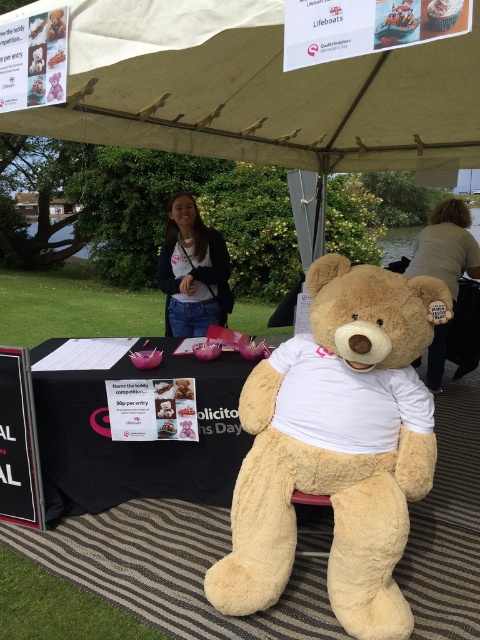
In the scene shown: Between fluffy beige teddy bear at center and matte white shirt at center, which one has more height?

fluffy beige teddy bear at center

Measure the distance between fluffy beige teddy bear at center and camera.

fluffy beige teddy bear at center and camera are 1.96 meters apart from each other.

I want to click on fluffy beige teddy bear at center, so click(x=336, y=449).

Does black fabric table at center lie in front of matte white shirt at center?

That is True.

Is black fabric table at center above matte white shirt at center?

No, black fabric table at center is not above matte white shirt at center.

Find the location of a particular element. This screenshot has height=640, width=480. black fabric table at center is located at coordinates (137, 442).

Does fluffy beige teddy bear at center come behind black fabric table at center?

No, it is in front of black fabric table at center.

Is point (374, 426) in front of point (64, 388)?

Yes, it is.

This screenshot has width=480, height=640. What are the coordinates of `fluffy beige teddy bear at center` in the screenshot? It's located at coord(336,449).